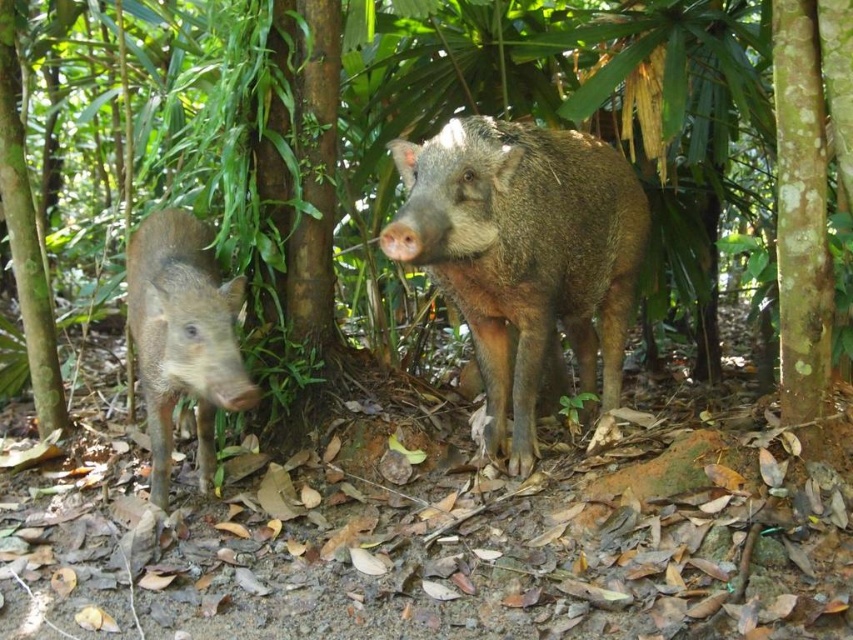
Question: Is brown rough textured pig at center to the right of brown matte pig at left from the viewer's perspective?

Choices:
 (A) no
 (B) yes

Answer: (B)

Question: Is brown rough textured pig at center above brown matte pig at left?

Choices:
 (A) yes
 (B) no

Answer: (A)

Question: Which point is farther to the camera?

Choices:
 (A) (538, 166)
 (B) (213, 362)

Answer: (A)

Question: Which object is closer to the camera taking this photo?

Choices:
 (A) brown matte pig at left
 (B) brown rough textured pig at center

Answer: (B)

Question: Can you confirm if brown rough textured pig at center is positioned above brown matte pig at left?

Choices:
 (A) no
 (B) yes

Answer: (B)